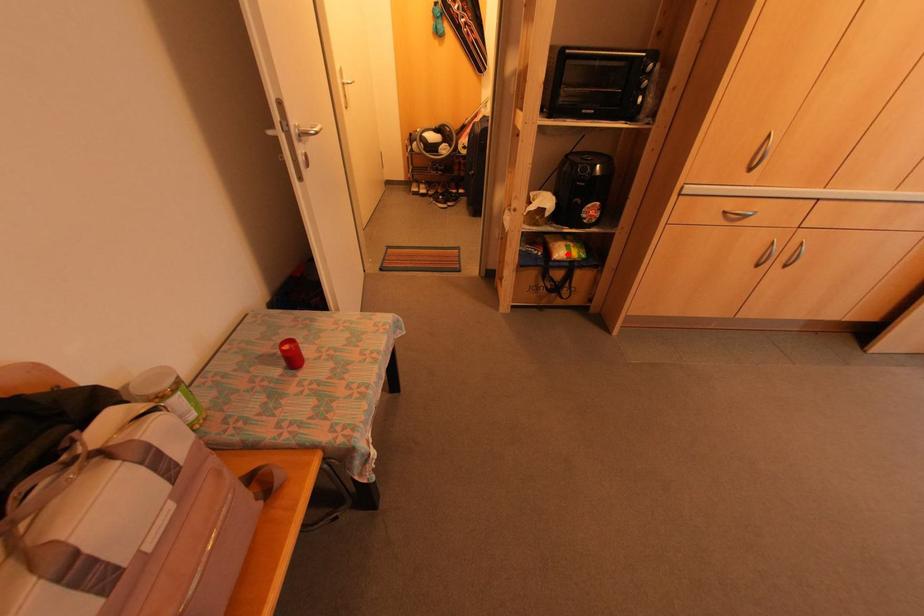
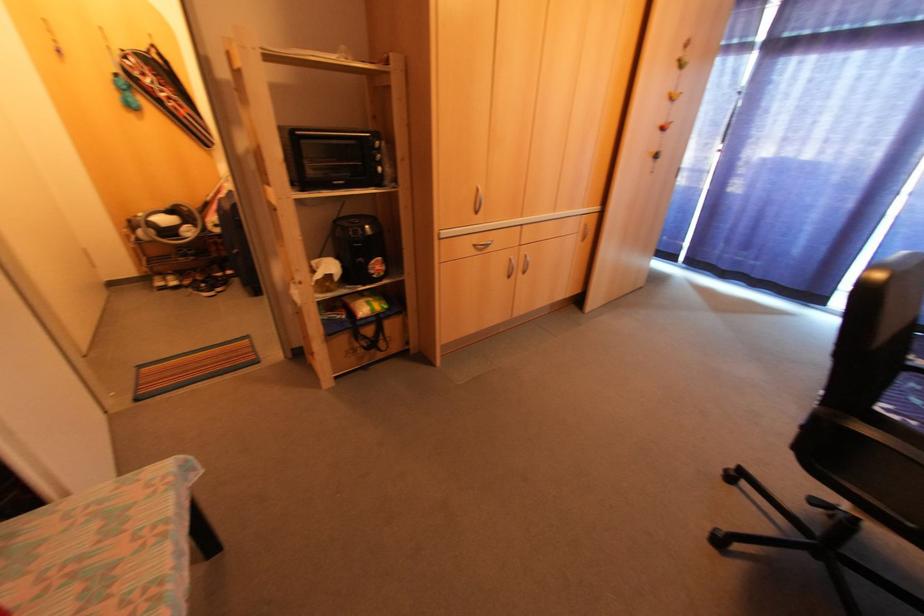
Where in the second image is the point corresponding to the highlighted location from the first image?

(370, 309)